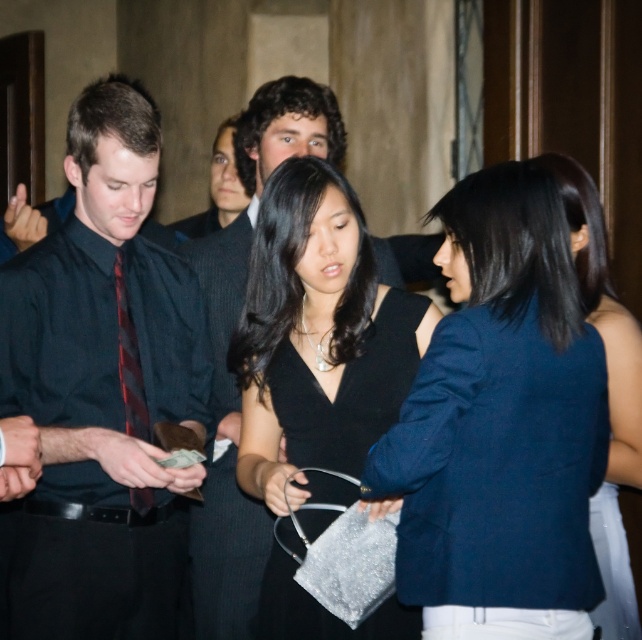
You are standing in the room and want to reach both points in the scene. Which point, point (447, 397) or point (195, 218), is closer to you?

Point (447, 397) is closer to the viewer than point (195, 218).

You are a photographer at a formal event and need to capture a photo of the dark blue fabric jacket at center and the shiny black dress at center. According to the scene description, which object is positioned to the right of the other?

The dark blue fabric jacket at center is to the right of the shiny black dress at center.